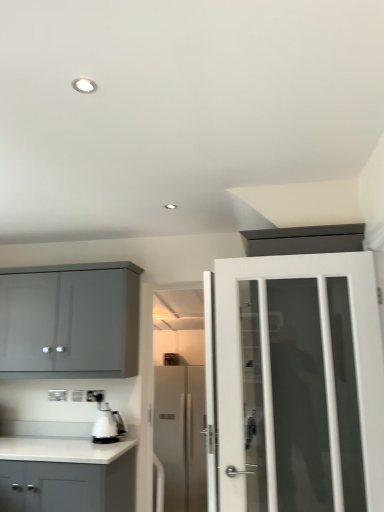
Question: Is white glossy coffee machine at lower left at the left side of white glass door at right, which is the 1th door in top-to-bottom order?

Choices:
 (A) yes
 (B) no

Answer: (A)

Question: Is white glossy coffee machine at lower left not within white glass door at right, which is the 1th door in top-to-bottom order?

Choices:
 (A) no
 (B) yes

Answer: (B)

Question: Is white glossy coffee machine at lower left taller than white glass door at right, acting as the 1th door starting from the front?

Choices:
 (A) no
 (B) yes

Answer: (A)

Question: Can white glass door at right, the 2th door when ordered from bottom to top, be found inside white glossy coffee machine at lower left?

Choices:
 (A) no
 (B) yes

Answer: (A)

Question: Is white glossy coffee machine at lower left beside white glass door at right, the second door when ordered from back to front?

Choices:
 (A) yes
 (B) no

Answer: (B)

Question: From a real-world perspective, is matte gray cabinet at upper left, the 1th cabinetry positioned from the top, above or below white glass door at right, the second door when ordered from back to front?

Choices:
 (A) below
 (B) above

Answer: (B)

Question: Considering the positions of matte gray cabinet at upper left, the 1th cabinetry positioned from the top, and white glass door at right, the 2th door when ordered from bottom to top, in the image, is matte gray cabinet at upper left, the 1th cabinetry positioned from the top, wider or thinner than white glass door at right, the 2th door when ordered from bottom to top,?

Choices:
 (A) wide
 (B) thin

Answer: (A)

Question: In terms of height, does matte gray cabinet at upper left, acting as the second cabinetry starting from the bottom, look taller or shorter compared to white glass door at right, the second door when ordered from back to front?

Choices:
 (A) tall
 (B) short

Answer: (B)

Question: Do you think matte gray cabinet at upper left, the 1th cabinetry positioned from the top, is within white glass door at right, the second door when ordered from back to front, or outside of it?

Choices:
 (A) inside
 (B) outside

Answer: (B)

Question: From their relative heights in the image, would you say white plastic electric outlet at lower center is taller or shorter than matte gray cabinet at upper left, acting as the second cabinetry starting from the bottom?

Choices:
 (A) short
 (B) tall

Answer: (A)

Question: Looking at the image, does white plastic electric outlet at lower center seem bigger or smaller compared to matte gray cabinet at upper left, the 1th cabinetry positioned from the top?

Choices:
 (A) big
 (B) small

Answer: (B)

Question: Is white plastic electric outlet at lower center wider or thinner than matte gray cabinet at upper left, acting as the second cabinetry starting from the bottom?

Choices:
 (A) wide
 (B) thin

Answer: (B)

Question: Does point (102, 392) appear closer or farther from the camera than point (117, 306)?

Choices:
 (A) farther
 (B) closer

Answer: (A)

Question: From their relative heights in the image, would you say satin silver refrigerator at center, acting as the second door starting from the front, is taller or shorter than white matte cabinet at lower left, which appears as the first cabinetry when ordered from the bottom?

Choices:
 (A) short
 (B) tall

Answer: (B)

Question: Looking at their shapes, would you say satin silver refrigerator at center, which is the 1th door from bottom to top, is wider or thinner than white matte cabinet at lower left, the second cabinetry when ordered from top to bottom?

Choices:
 (A) thin
 (B) wide

Answer: (B)